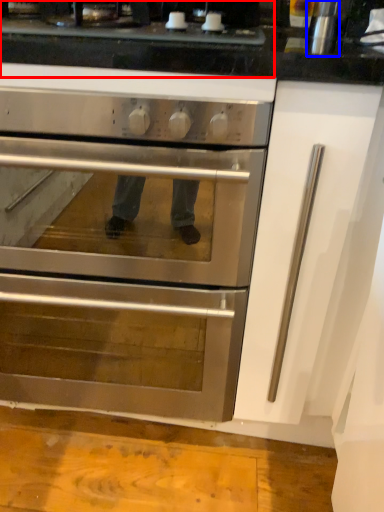
Question: Among these objects, which one is nearest to the camera, gas stove (highlighted by a red box) or appliance (highlighted by a blue box)?

Choices:
 (A) gas stove
 (B) appliance

Answer: (A)